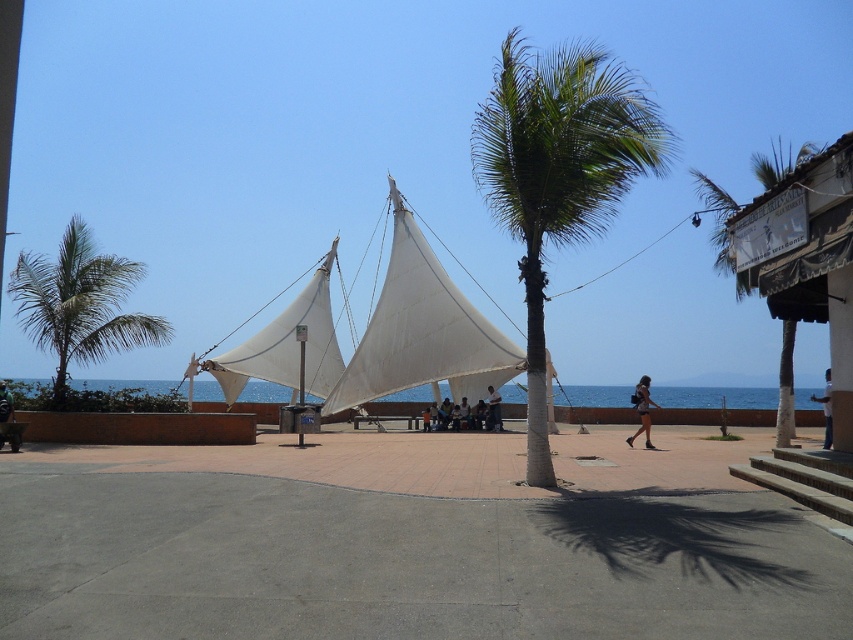
Is green leafy palm tree at left above white fabric canopy at center?

Correct, green leafy palm tree at left is located above white fabric canopy at center.

Does point (57, 300) come farther from viewer compared to point (331, 323)?

That is False.

Measure the distance between point (56, 352) and camera.

20.46 meters

The width and height of the screenshot is (853, 640). I want to click on green leafy palm tree at left, so point(80,305).

Which is more to the right, green leafy palm tree at center or white cotton shirt at center?

white cotton shirt at center is more to the right.

What do you see at coordinates (558, 173) in the screenshot? Image resolution: width=853 pixels, height=640 pixels. I see `green leafy palm tree at center` at bounding box center [558, 173].

I want to click on green leafy palm tree at center, so click(558, 173).

Can you confirm if green leafy palm tree at left is bigger than dark blue jeans at center?

Indeed, green leafy palm tree at left has a larger size compared to dark blue jeans at center.

Does green leafy palm tree at left have a greater height compared to dark blue jeans at center?

Indeed, green leafy palm tree at left has a greater height compared to dark blue jeans at center.

Describe the element at coordinates (80, 305) in the screenshot. I see `green leafy palm tree at left` at that location.

I want to click on green leafy palm tree at left, so click(80, 305).